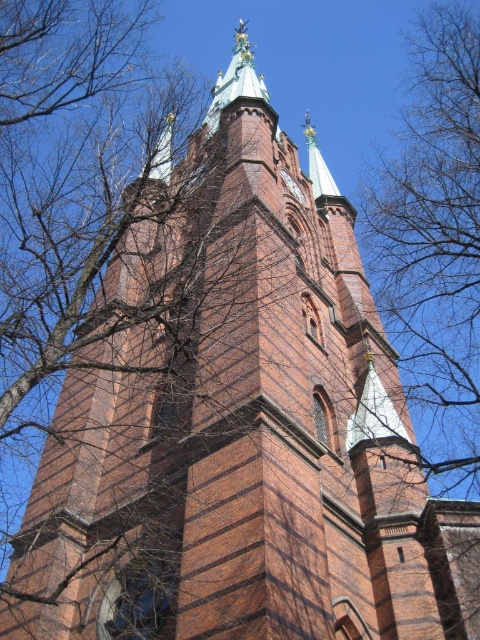
You are an ornithologist observing birds in the area of the church tower. You notice a bird perched on a branch. Based on the scene description, can you determine the exact coordinates where the bare branches at upper right are located?

The bare branches at upper right are located at coordinates point (434, 243).

You are standing at the base of the church tower and want to take a photo of the point at coordinates point (389, 189). If your camera can focus on objects up to 150 meters away, will you be able to capture the point clearly?

The distance of point (389, 189) from camera is 145.77 meters, which is within the camera focus range of 150 meters. Therefore, you can capture the point clearly.

You are a window cleaner standing on a platform that can extend up to 150 feet. You need to clean both the bare branches at upper right and the polished brass clock at upper center. Can your platform reach both objects?

The distance between the bare branches at upper right and the polished brass clock at upper center is 159.60 feet. Since your platform can only extend up to 150 feet, it cannot reach either object as the required distance exceeds its maximum reach.